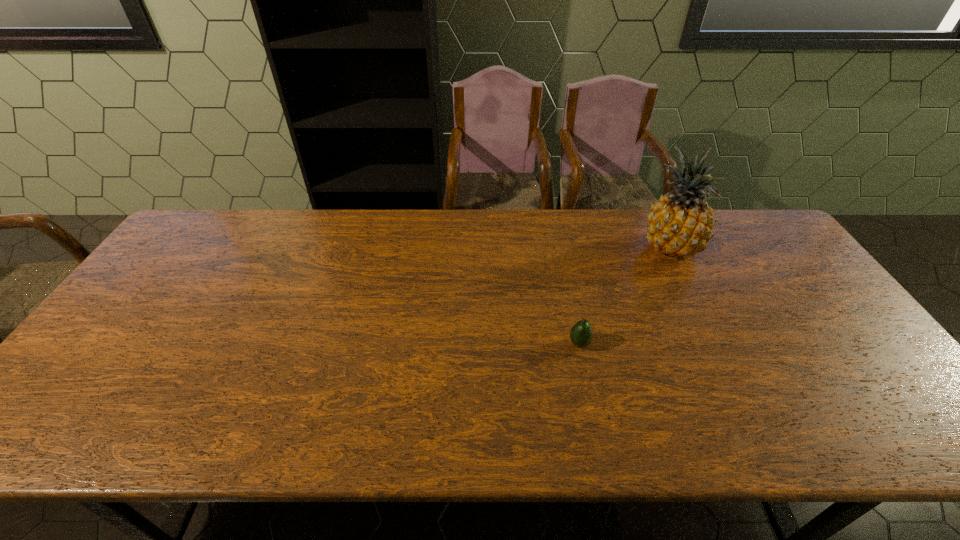
I want to click on the right object, so click(680, 223).

Identify the location of the farther object. This screenshot has height=540, width=960. (680, 223).

The image size is (960, 540). Identify the location of the shorter object. (581, 334).

Locate an element on the screen. Image resolution: width=960 pixels, height=540 pixels. the left object is located at coordinates (581, 334).

Identify the location of free point located 0.260m on the right of the right object. (783, 248).

I want to click on vacant region located on the back of the left object, so pos(559,244).

Locate an element on the screen. object present at the far edge is located at coordinates (680, 223).

Locate an element on the screen. Image resolution: width=960 pixels, height=540 pixels. vacant space at the far edge is located at coordinates (328, 219).

Find the location of a particular element. This screenshot has height=540, width=960. vacant space at the left edge of the desktop is located at coordinates (149, 295).

In the image, there is a desktop. Where is `vacant region at the right edge`? vacant region at the right edge is located at coordinates (800, 266).